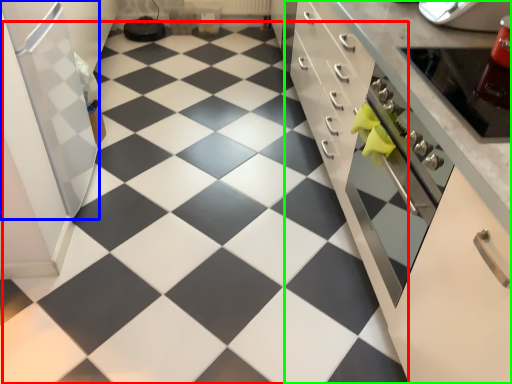
Question: Based on their relative distances, which object is farther from tile (highlighted by a red box)? Choose from appliance (highlighted by a blue box) and cabinetry (highlighted by a green box).

Choices:
 (A) appliance
 (B) cabinetry

Answer: (B)